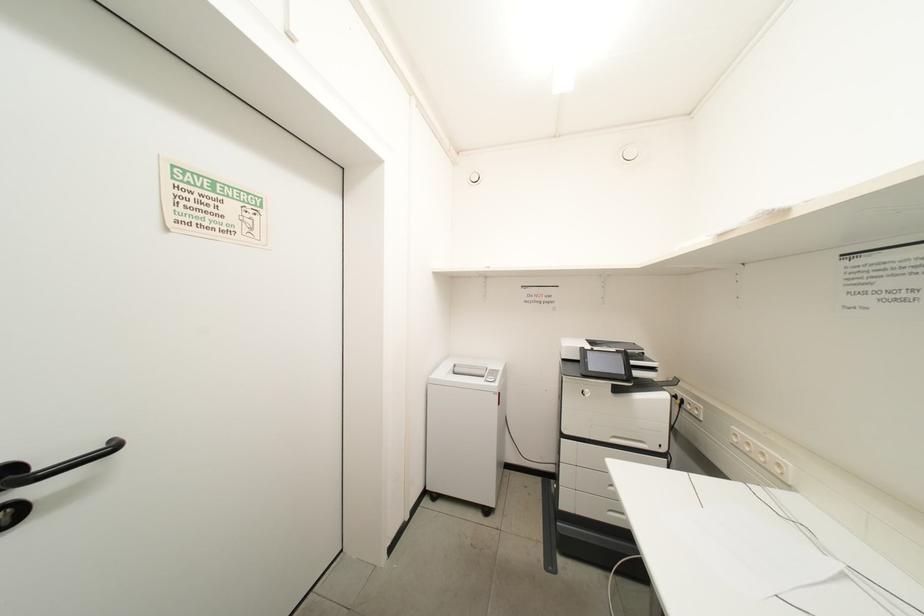
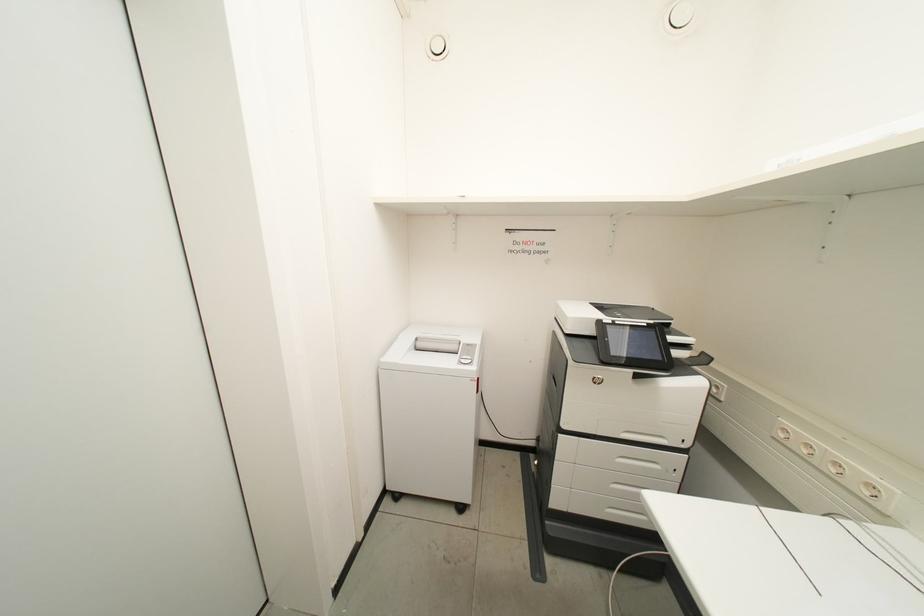
Question: Based on the continuous images, in which direction is the camera rotating? Reply with the corresponding letter.

Choices:
 (A) Left
 (B) Right
 (C) Up
 (D) Down

Answer: (D)